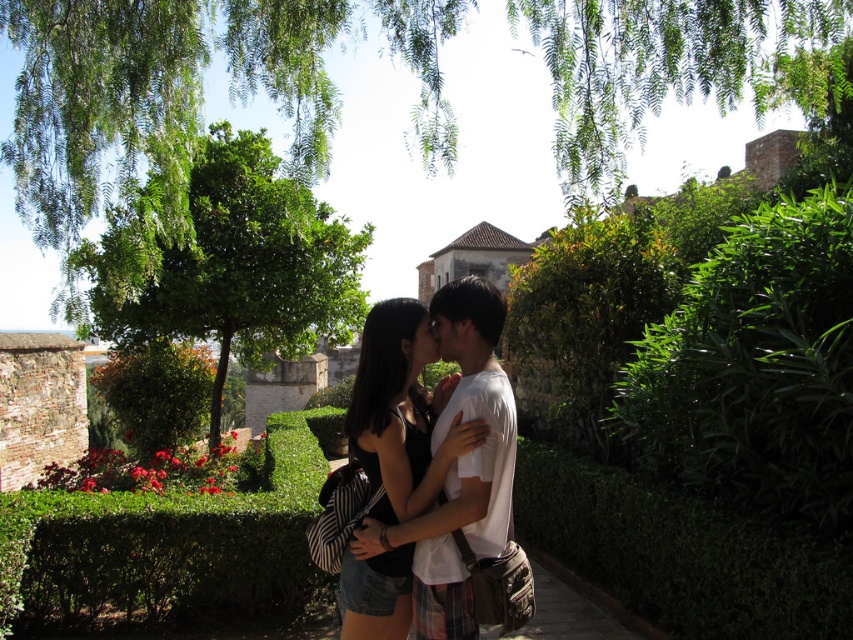
Based on the photo, does green leafy tree at center have a lesser height compared to matte black dress at center?

No.

Can you confirm if green leafy tree at center is taller than matte black dress at center?

Yes.

Does point (155, 273) come behind point (432, 360)?

Yes, point (155, 273) is behind point (432, 360).

This screenshot has width=853, height=640. Identify the location of green leafy tree at center. (228, 262).

Based on the photo, who is taller, green leafy tree at upper center or matte black dress at center?

Standing taller between the two is green leafy tree at upper center.

Looking at this image, who is more forward, (148, 120) or (474, 416)?

Positioned in front is point (474, 416).

The height and width of the screenshot is (640, 853). What do you see at coordinates (190, 84) in the screenshot?
I see `green leafy tree at upper center` at bounding box center [190, 84].

Where is `green leafy tree at upper center`? This screenshot has height=640, width=853. green leafy tree at upper center is located at coordinates (190, 84).

Is point (299, 124) farther from viewer compared to point (218, 280)?

No, (299, 124) is in front of (218, 280).

Does green leafy tree at upper center appear over green leafy tree at center?

Indeed, green leafy tree at upper center is positioned over green leafy tree at center.

This screenshot has height=640, width=853. Describe the element at coordinates (190, 84) in the screenshot. I see `green leafy tree at upper center` at that location.

Identify the location of green leafy tree at upper center. (190, 84).